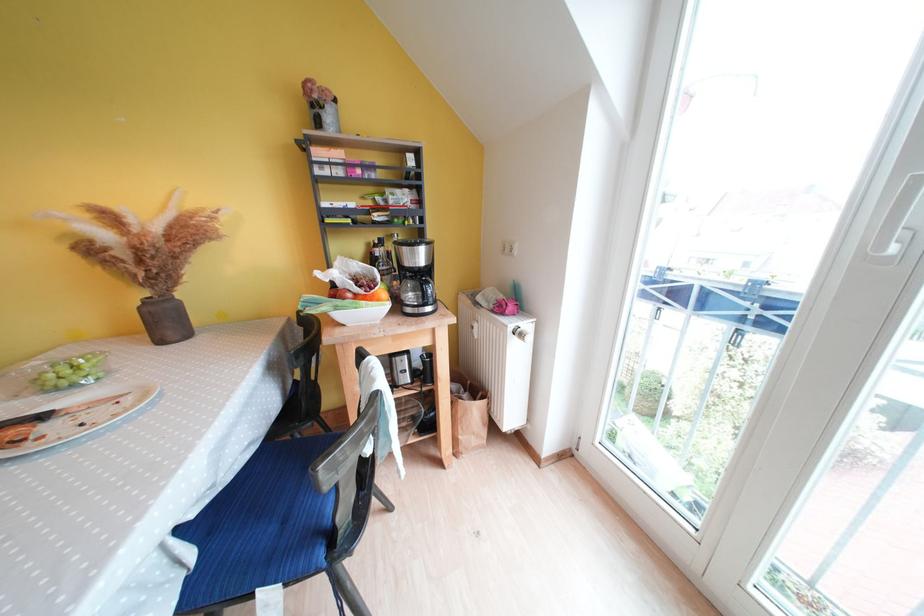
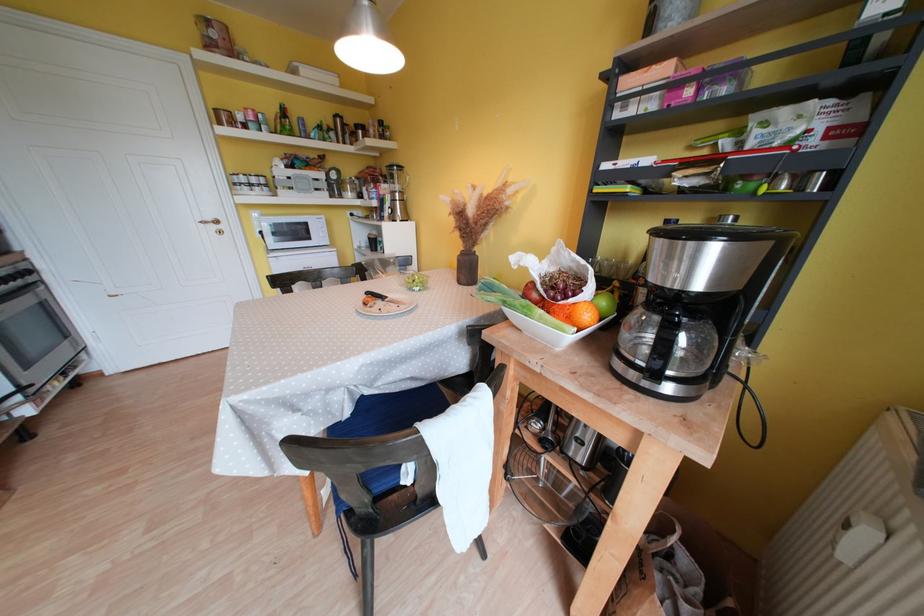
The first image is from the beginning of the video and the second image is from the end. How did the camera likely rotate when shooting the video?

The camera's rotation is toward left-down.